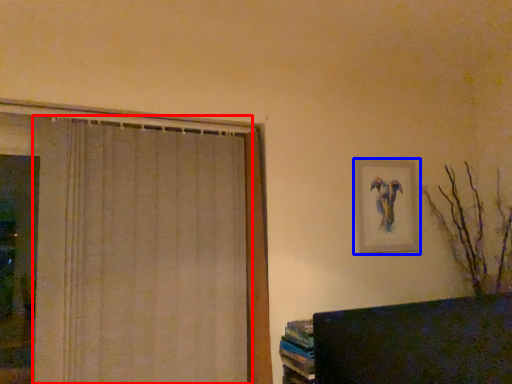
Question: Which point is closer to the camera, curtain (highlighted by a red box) or picture frame (highlighted by a blue box)?

Choices:
 (A) curtain
 (B) picture frame

Answer: (A)